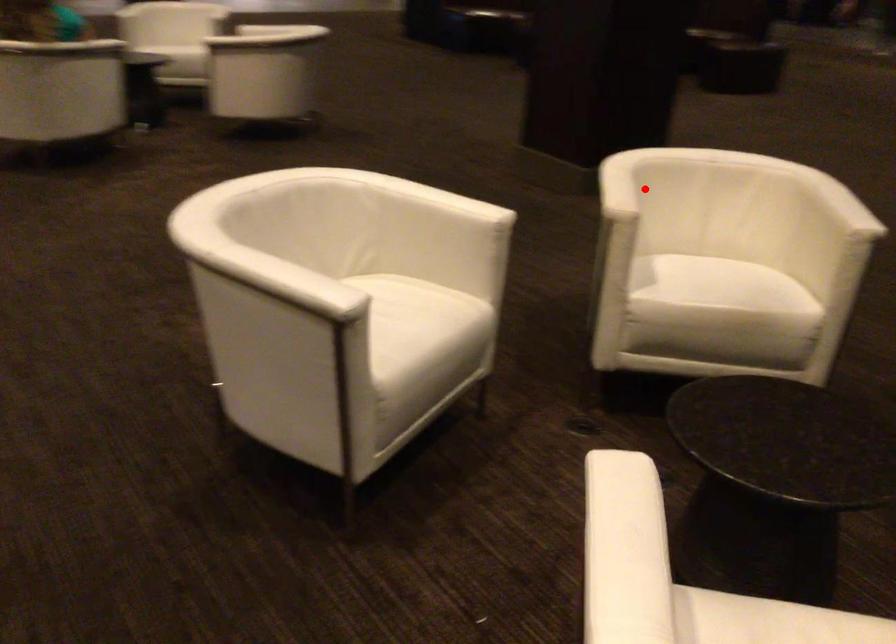
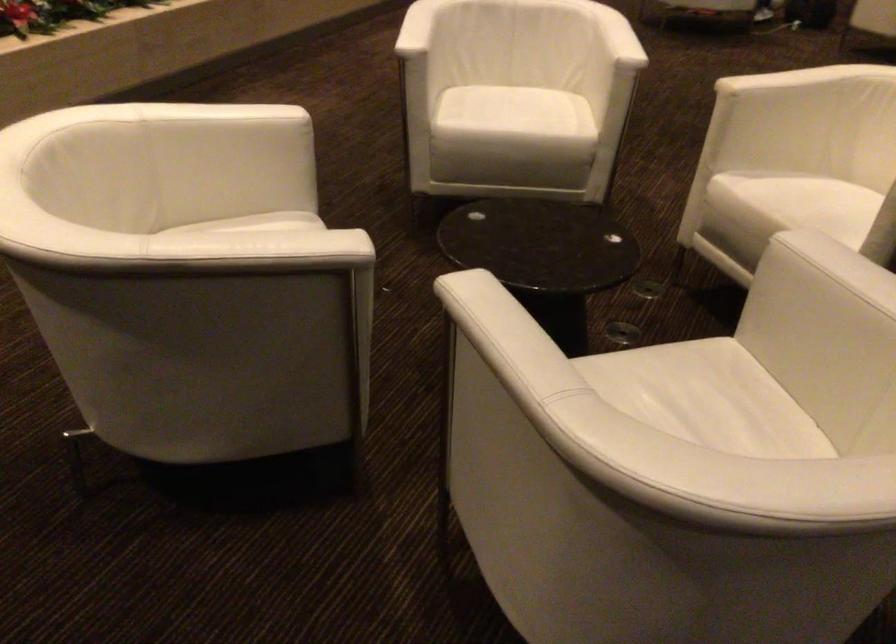
Question: I am providing you with two images of the same scene from different viewpoints. A red point is shown in image1. For the corresponding object point in image2, is it positioned nearer or farther from the camera?

Choices:
 (A) Nearer
 (B) Farther

Answer: (A)